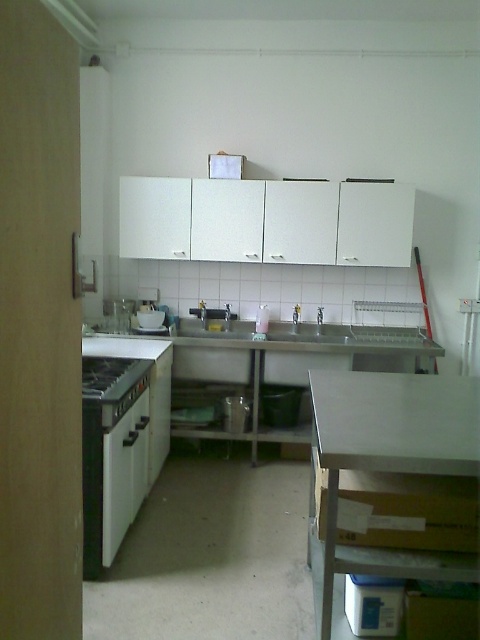
What is located at the point with coordinates [279,362] in the kitchen scene?

The point at coordinates [279,362] is occupied by the stainless steel counter top at center.

You are a kitchen designer planning to install a new appliance between the black matte oven at left and the black matte stove at lower left. The appliance requires a minimum of 8 inches of space. Based on the current setup, is there enough space for the new appliance?

The black matte oven at left is only 6.00 inches from the black matte stove at lower left, which is less than the required 8 inches. Therefore, there is not enough space to install the new appliance between them.